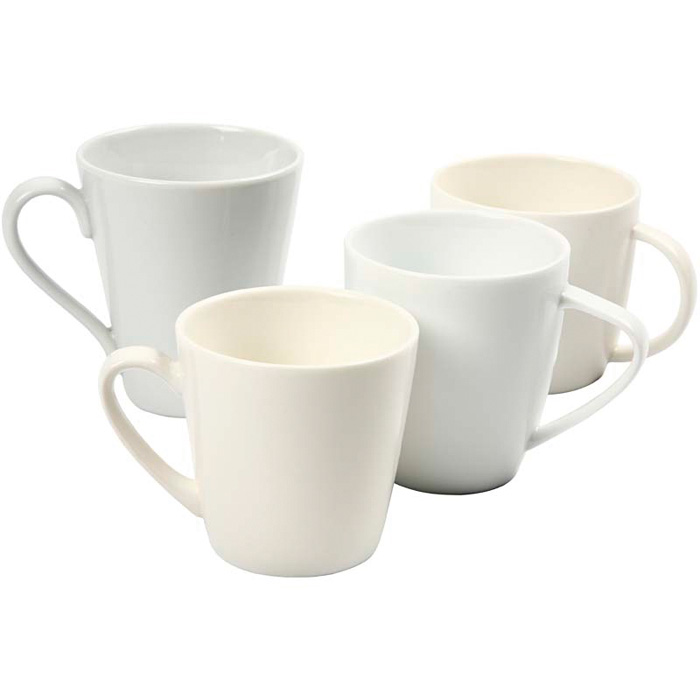
Where is `mug handle`? mug handle is located at coordinates (104, 396), (12, 218), (638, 346), (686, 276).